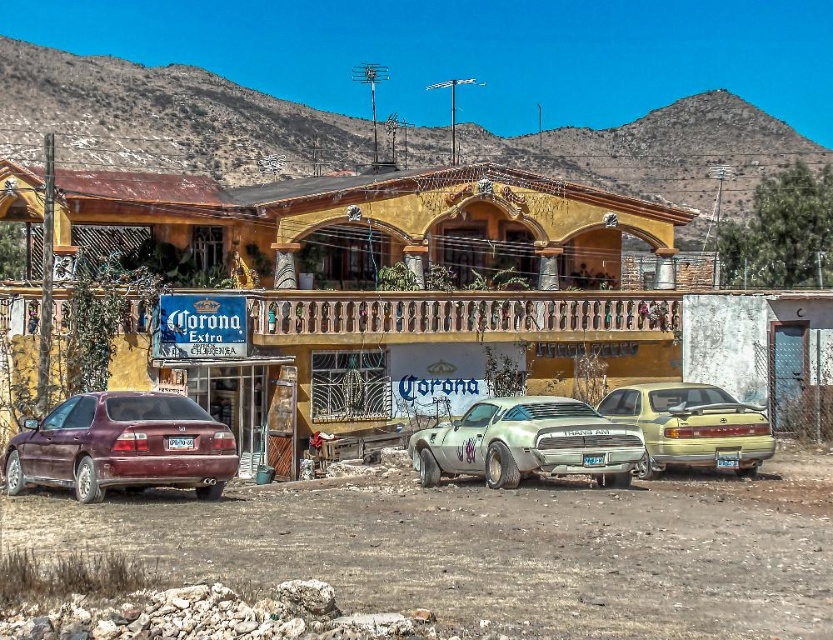
Question: Is matte yellow building at center behind satin burgundy sedan at lower left?

Choices:
 (A) no
 (B) yes

Answer: (B)

Question: Which of these objects is positioned farthest from the metallic gold sedan at right?

Choices:
 (A) satin burgundy sedan at lower left
 (B) matte yellow building at center
 (C) silver metallic muscle car at center

Answer: (A)

Question: Estimate the real-world distances between objects in this image. Which object is farther from the metallic gold sedan at right?

Choices:
 (A) silver metallic muscle car at center
 (B) satin burgundy sedan at lower left
 (C) matte yellow building at center

Answer: (B)

Question: Based on their relative distances, which object is farther from the matte yellow building at center?

Choices:
 (A) silver metallic muscle car at center
 (B) metallic gold sedan at right
 (C) satin burgundy sedan at lower left

Answer: (C)

Question: Can you confirm if matte yellow building at center is smaller than silver metallic muscle car at center?

Choices:
 (A) no
 (B) yes

Answer: (A)

Question: Can you confirm if satin burgundy sedan at lower left is smaller than silver metallic muscle car at center?

Choices:
 (A) yes
 (B) no

Answer: (B)